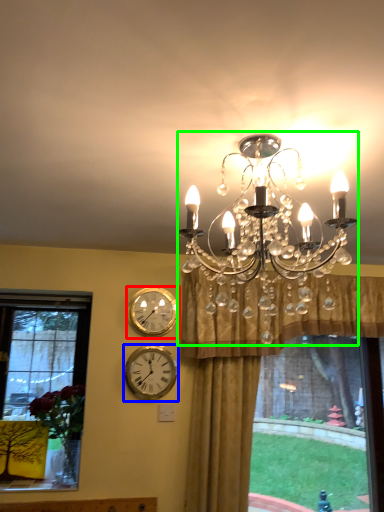
Question: Which object is positioned closest to wall clock (highlighted by a red box)? Select from wall clock (highlighted by a blue box) and lamp (highlighted by a green box).

Choices:
 (A) wall clock
 (B) lamp

Answer: (A)